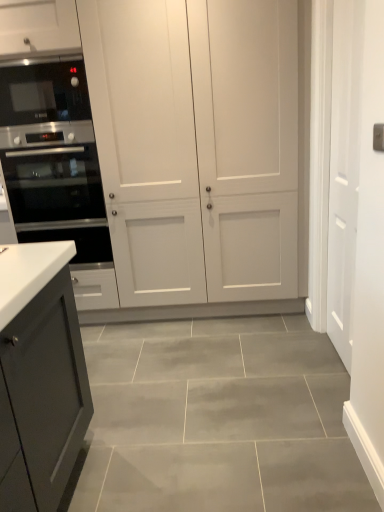
What is the approximate width of white matte door at right?

white matte door at right is 5.40 inches wide.

I want to click on satin black oven at left, so click(x=56, y=186).

The width and height of the screenshot is (384, 512). Find the location of `white matte door at right`. white matte door at right is located at coordinates (344, 170).

Is white matte door at right bigger than white matte cabinet at center?

No.

Is white matte door at right taller or shorter than white matte cabinet at center?

In the image, white matte door at right appears to be shorter than white matte cabinet at center.

From a real-world perspective, is white matte door at right positioned under white matte cabinet at center based on gravity?

Yes, from a real-world perspective, white matte door at right is under white matte cabinet at center.

From the image's perspective, does white matte door at right appear higher than white matte cabinet at center?

No, from the image's perspective, white matte door at right is not over white matte cabinet at center.

Looking at this image, from the image's perspective, which is below, white matte cabinet at center or black glass microwave at left?

white matte cabinet at center appears lower in the image.

Is white matte cabinet at center to the left or to the right of black glass microwave at left in the image?

In the image, white matte cabinet at center appears on the right side of black glass microwave at left.

Would you say white matte cabinet at center is inside or outside black glass microwave at left?

white matte cabinet at center is spatially situated outside black glass microwave at left.

Is the position of white matte cabinet at center more distant than that of black glass microwave at left?

No.

Considering the sizes of objects black glass microwave at left and satin black oven at left in the image provided, who is smaller, black glass microwave at left or satin black oven at left?

black glass microwave at left.

Between point (68, 62) and point (39, 153), which one is positioned in front?

The point (68, 62) is in front.

Which is more to the left, black glass microwave at left or satin black oven at left?

black glass microwave at left is more to the left.

Is black glass microwave at left next to satin black oven at left and touching it?

black glass microwave at left and satin black oven at left are not in contact.

From a real-world perspective, does black glass microwave at left stand above white matte cabinet at center?

Correct, in the physical world, black glass microwave at left is higher than white matte cabinet at center.

Where is `microwave oven that appears on the left of white matte cabinet at center`? microwave oven that appears on the left of white matte cabinet at center is located at coordinates (43, 92).

Based on the photo, is black glass microwave at left directly adjacent to white matte cabinet at center?

No, black glass microwave at left is not next to white matte cabinet at center.

Looking at their sizes, would you say black glass microwave at left is wider or thinner than white matte cabinet at center?

Clearly, black glass microwave at left has less width compared to white matte cabinet at center.

Find the location of a particular element. Image resolution: width=384 pixels, height=512 pixels. microwave oven that is in front of the satin black oven at left is located at coordinates (x=43, y=92).

From the image's perspective, who appears lower, satin black oven at left or black glass microwave at left?

satin black oven at left, from the image's perspective.

Considering the sizes of objects satin black oven at left and black glass microwave at left in the image provided, who is smaller, satin black oven at left or black glass microwave at left?

black glass microwave at left.

Does white matte cabinet at center turn towards white matte door at right?

Yes.

Is point (280, 186) more distant than point (355, 2)?

Yes, point (280, 186) is farther from viewer.

Which is in front, white matte cabinet at center or white matte door at right?

white matte door at right.

Does white matte door at right contain satin black oven at left?

No, satin black oven at left is located outside of white matte door at right.

Considering the relative sizes of white matte door at right and satin black oven at left in the image provided, is white matte door at right shorter than satin black oven at left?

No, white matte door at right is not shorter than satin black oven at left.

Find the location of a particular element. The image size is (384, 512). door in front of the satin black oven at left is located at coordinates (344, 170).

From a real-world perspective, who is located lower, white matte door at right or satin black oven at left?

In real-world perspective, satin black oven at left is lower.

You are a GUI agent. You are given a task and a screenshot of the screen. Output one action in this format:
    pyautogui.click(x=<x>, y=<y>)
    Task: Click on the cupboard on the left of white matte door at right
    This screenshot has width=384, height=512.
    Given the screenshot: What is the action you would take?
    pyautogui.click(x=180, y=149)

Locate an element on the screen. The image size is (384, 512). cupboard lying on the right of black glass microwave at left is located at coordinates (180, 149).

Looking at the image, which one is located closer to white matte door at right, black glass microwave at left or satin black oven at left?

Based on the image, satin black oven at left appears to be nearer to white matte door at right.

From the picture: From the image, which object appears to be farther from black glass microwave at left, white matte cabinet at center or white matte door at right?

white matte door at right.

When comparing their distances from white matte cabinet at center, does satin black oven at left or white matte door at right seem further?

white matte door at right.

Based on the photo, considering their positions, is white matte door at right positioned closer to white matte cabinet at center than satin black oven at left?

Among the two, satin black oven at left is located nearer to white matte cabinet at center.

From the image, which object appears to be nearer to satin black oven at left, white matte cabinet at center or white matte door at right?

white matte cabinet at center is closer to satin black oven at left.

Which object lies nearer to the anchor point white matte door at right, white matte cabinet at center or satin black oven at left?

white matte cabinet at center is positioned closer to the anchor white matte door at right.

Estimate the real-world distances between objects in this image. Which object is closer to white matte cabinet at center, white matte door at right or black glass microwave at left?

black glass microwave at left is closer to white matte cabinet at center.

Based on their spatial positions, is white matte door at right or white matte cabinet at center further from satin black oven at left?

The object further to satin black oven at left is white matte door at right.

Where is `oven between black glass microwave at left and white matte cabinet at center`? Image resolution: width=384 pixels, height=512 pixels. oven between black glass microwave at left and white matte cabinet at center is located at coordinates [x=56, y=186].

You are a GUI agent. You are given a task and a screenshot of the screen. Output one action in this format:
    pyautogui.click(x=<x>, y=<y>)
    Task: Click on the cupboard located between black glass microwave at left and white matte door at right in the left-right direction
    This screenshot has height=512, width=384.
    Given the screenshot: What is the action you would take?
    pyautogui.click(x=180, y=149)

Where is `oven situated between black glass microwave at left and white matte door at right from left to right`? This screenshot has width=384, height=512. oven situated between black glass microwave at left and white matte door at right from left to right is located at coordinates tap(56, 186).

You are a GUI agent. You are given a task and a screenshot of the screen. Output one action in this format:
    pyautogui.click(x=<x>, y=<y>)
    Task: Click on the cupboard between satin black oven at left and white matte door at right from left to right
    The height and width of the screenshot is (512, 384).
    Given the screenshot: What is the action you would take?
    pyautogui.click(x=180, y=149)